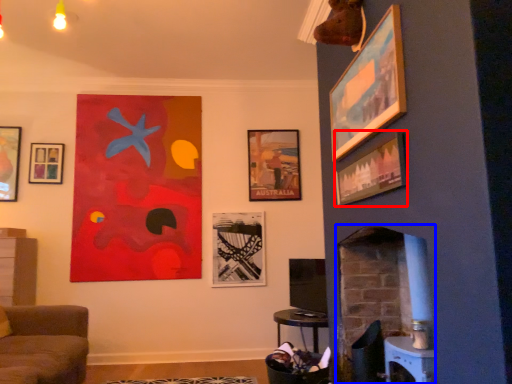
Question: Which object appears closest to the camera in this image, picture frame (highlighted by a red box) or fireplace (highlighted by a blue box)?

Choices:
 (A) picture frame
 (B) fireplace

Answer: (A)